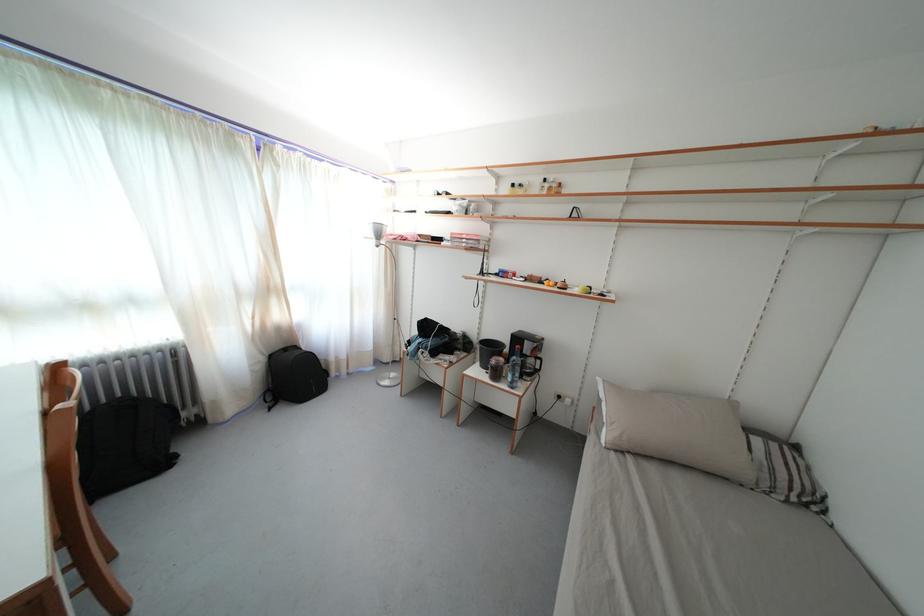
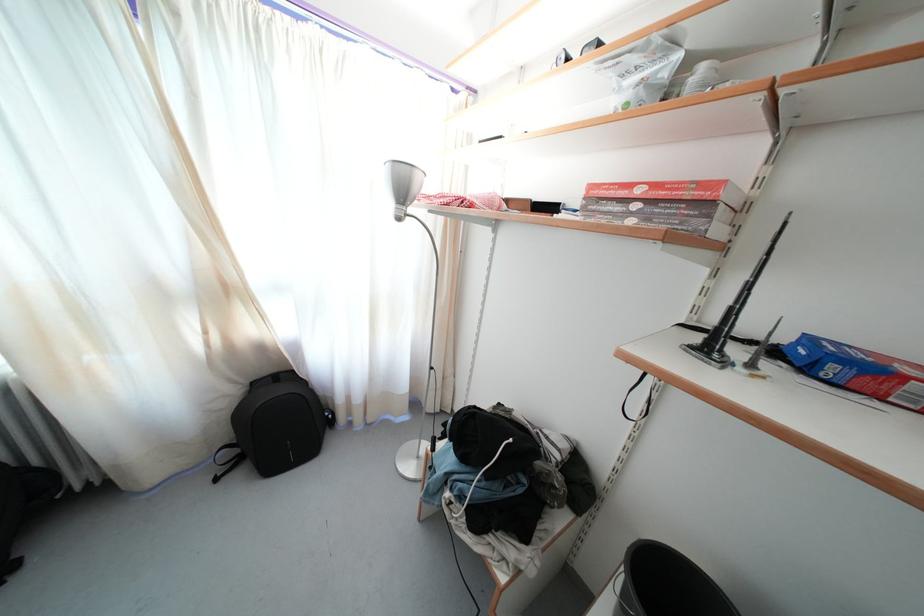
The point at [479,209] is marked in the first image. Where is the corresponding point in the second image?

(709, 73)